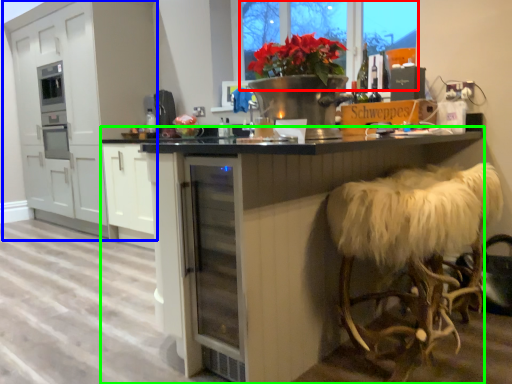
Question: Which object is positioned farthest from window screen (highlighted by a red box)? Select from cabinetry (highlighted by a blue box) and table (highlighted by a green box).

Choices:
 (A) cabinetry
 (B) table

Answer: (A)